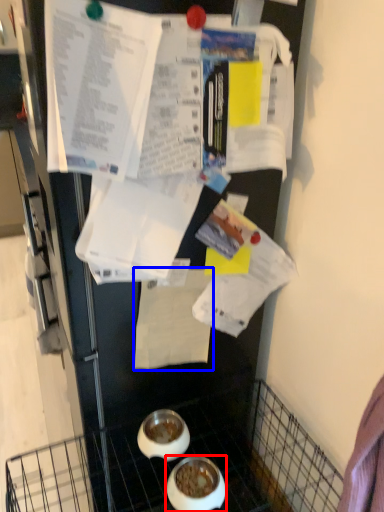
Question: Which of the following is the farthest to the observer, bowl (highlighted by a red box) or paper (highlighted by a blue box)?

Choices:
 (A) bowl
 (B) paper

Answer: (B)